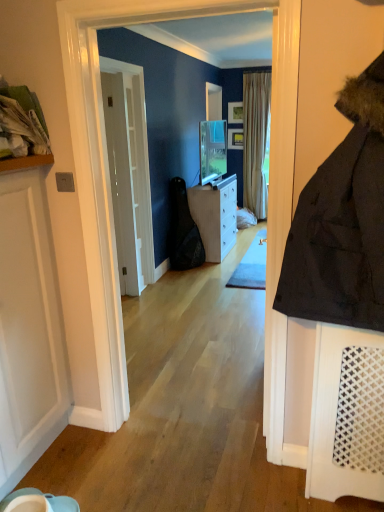
Where is `vacant area situated below white matte door at left, the 1th door viewed from the front (from a real-world perspective)`? This screenshot has height=512, width=384. vacant area situated below white matte door at left, the 1th door viewed from the front (from a real-world perspective) is located at coordinates (59, 460).